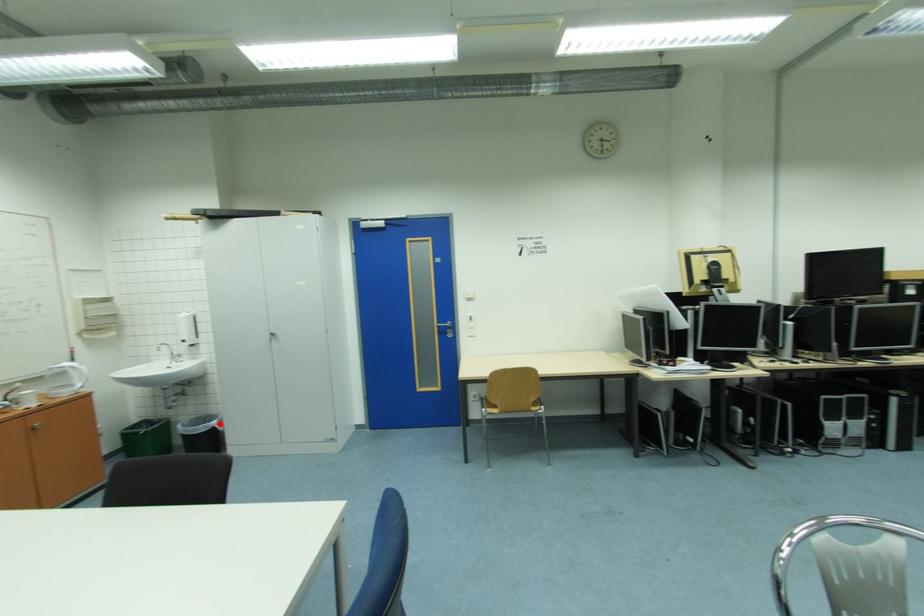
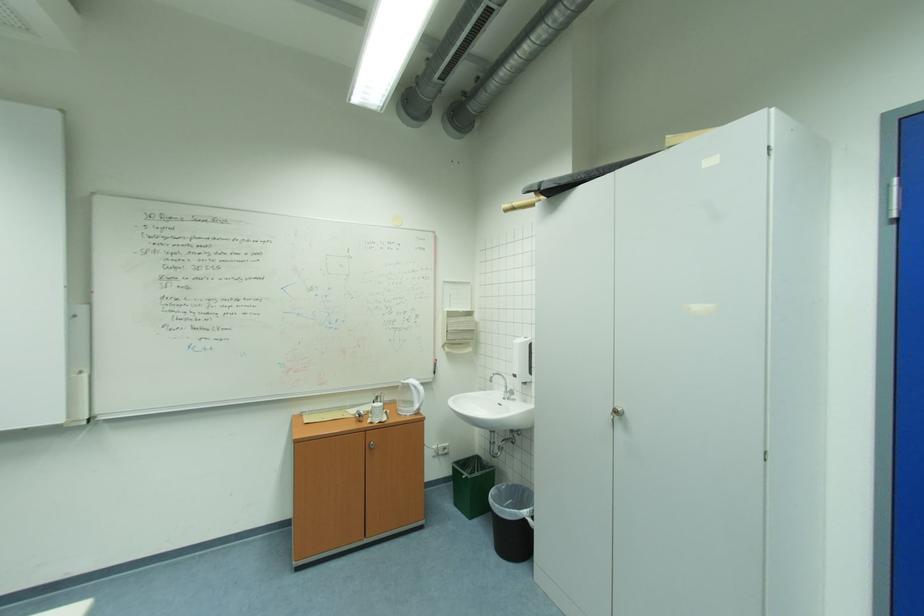
The point at the highlighted location is marked in the first image. Where is the corresponding point in the second image?

(532, 513)